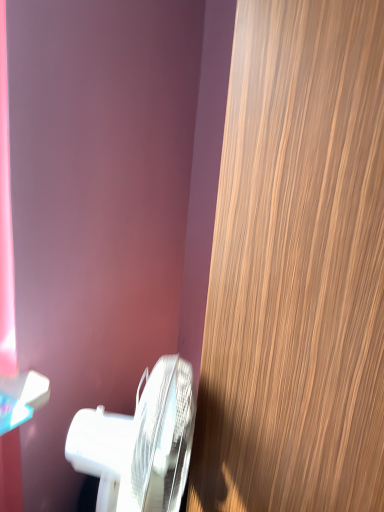
Measure the distance between point [106,471] and camera.

35.51 inches.

I want to click on white glossy toilet at lower left, so 140,443.

What is the approximate width of white glossy toilet at lower left?

It is 11.00 inches.

This screenshot has height=512, width=384. What do you see at coordinates (140, 443) in the screenshot? I see `white glossy toilet at lower left` at bounding box center [140, 443].

Locate an element on the screen. wooden door at right is located at coordinates (297, 268).

Image resolution: width=384 pixels, height=512 pixels. What do you see at coordinates (297, 268) in the screenshot?
I see `wooden door at right` at bounding box center [297, 268].

In order to click on white glossy toilet at lower left in this screenshot , I will do pyautogui.click(x=140, y=443).

Which is more to the right, wooden door at right or white glossy toilet at lower left?

From the viewer's perspective, wooden door at right appears more on the right side.

Who is more distant, wooden door at right or white glossy toilet at lower left?

white glossy toilet at lower left.

Which is in front, point (374, 75) or point (164, 445)?

Positioned in front is point (374, 75).

From the image's perspective, which object appears higher, wooden door at right or white glossy toilet at lower left?

wooden door at right, from the image's perspective.

From a real-world perspective, which object rests below the other?

white glossy toilet at lower left is physically lower.

Which of these two, wooden door at right or white glossy toilet at lower left, is thinner?

white glossy toilet at lower left.

In the scene shown: Is wooden door at right taller than white glossy toilet at lower left?

Yes.

Can you confirm if wooden door at right is bigger than white glossy toilet at lower left?

Correct, wooden door at right is larger in size than white glossy toilet at lower left.

Is wooden door at right positioned beyond the bounds of white glossy toilet at lower left?

Yes.

Consider the image. Is wooden door at right touching white glossy toilet at lower left?

They are not placed beside each other.

Is wooden door at right aimed at white glossy toilet at lower left?

No, wooden door at right is not turned towards white glossy toilet at lower left.

How much distance is there between wooden door at right and white glossy toilet at lower left?

9.75 inches.

Find the location of a particular element. The image size is (384, 512). toilet behind the wooden door at right is located at coordinates (140, 443).

Is white glossy toilet at lower left to the right of wooden door at right from the viewer's perspective?

Incorrect, white glossy toilet at lower left is not on the right side of wooden door at right.

Considering their positions, is white glossy toilet at lower left located in front of or behind wooden door at right?

Clearly, white glossy toilet at lower left is behind wooden door at right.

Which point is more distant from viewer, [140,428] or [277,72]?

The point [140,428] is more distant.

From the image's perspective, is white glossy toilet at lower left above or below wooden door at right?

Clearly, from the image's perspective, white glossy toilet at lower left is below wooden door at right.

From a real-world perspective, does white glossy toilet at lower left stand above wooden door at right?

Incorrect, from a real-world perspective, white glossy toilet at lower left is lower than wooden door at right.

In terms of width, does white glossy toilet at lower left look wider or thinner when compared to wooden door at right?

Clearly, white glossy toilet at lower left has less width compared to wooden door at right.

From their relative heights in the image, would you say white glossy toilet at lower left is taller or shorter than wooden door at right?

In the image, white glossy toilet at lower left appears to be shorter than wooden door at right.

Is white glossy toilet at lower left smaller than wooden door at right?

Yes, white glossy toilet at lower left is smaller than wooden door at right.

Choose the correct answer: Is white glossy toilet at lower left inside wooden door at right or outside it?

white glossy toilet at lower left is spatially situated outside wooden door at right.

Is white glossy toilet at lower left not near wooden door at right?

white glossy toilet at lower left is actually quite close to wooden door at right.

Does white glossy toilet at lower left turn towards wooden door at right?

Yes, white glossy toilet at lower left is oriented towards wooden door at right.

In order to click on toilet located underneath the wooden door at right (from a real-world perspective) in this screenshot , I will do `click(140, 443)`.

This screenshot has height=512, width=384. Find the location of `door above the white glossy toilet at lower left (from a real-world perspective)`. door above the white glossy toilet at lower left (from a real-world perspective) is located at coordinates (297, 268).

The image size is (384, 512). Identify the location of toilet located behind the wooden door at right. (140, 443).